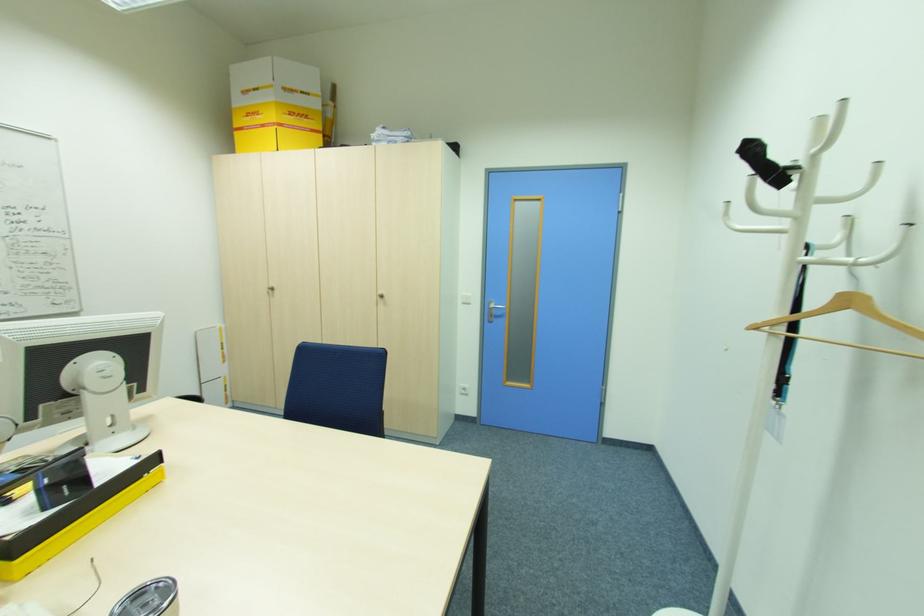
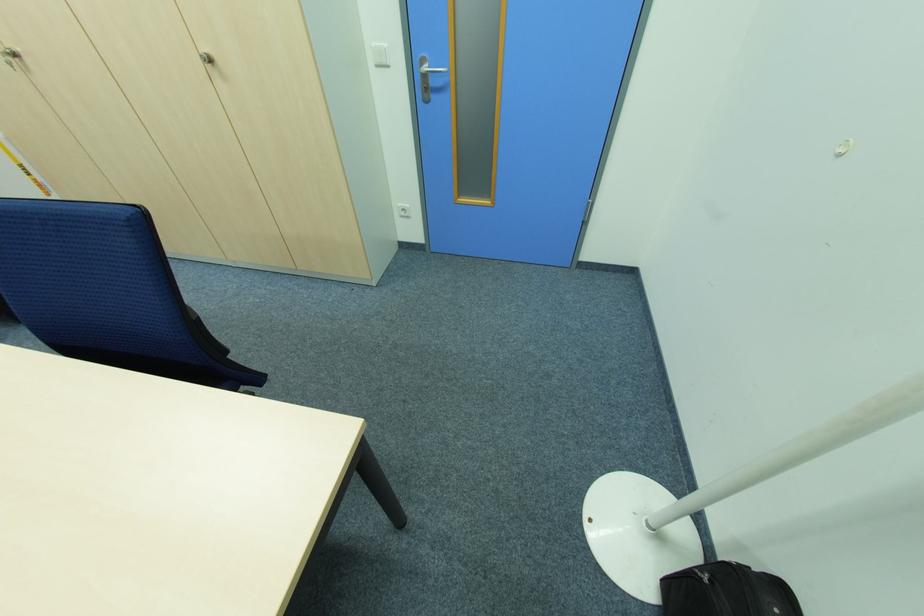
Find the pixel in the second image that matches point 384,297 in the first image.

(213, 62)